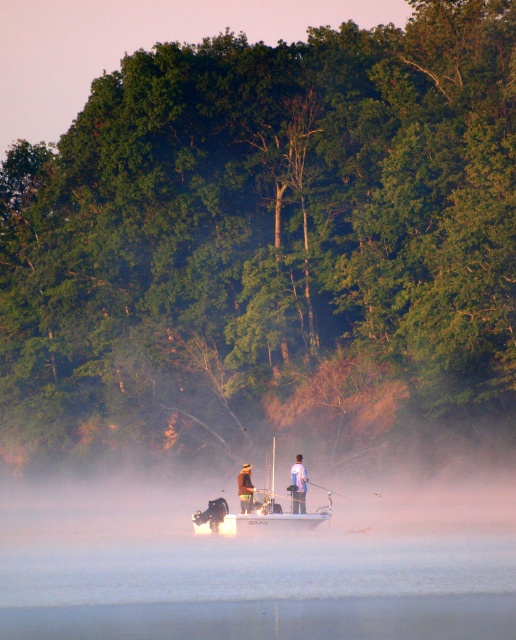
The width and height of the screenshot is (516, 640). Describe the element at coordinates (262, 506) in the screenshot. I see `white plastic boat at center` at that location.

Image resolution: width=516 pixels, height=640 pixels. In order to click on white plastic boat at center in this screenshot , I will do `click(262, 506)`.

From the picture: Who is lower down, white plastic boat at center or blue fabric shirt at center?

blue fabric shirt at center is lower down.

Is point (223, 513) positioned before point (303, 497)?

Yes, point (223, 513) is in front of point (303, 497).

Image resolution: width=516 pixels, height=640 pixels. What are the coordinates of `white plastic boat at center` in the screenshot? It's located at (262, 506).

Is blue fabric shirt at center below brown leather jacket at center?

Yes.

Who is more forward, (294, 512) or (249, 465)?

Point (294, 512) is in front.

Based on the photo, who is more forward, (296, 492) or (249, 490)?

Point (296, 492)

At what (x,y) coordinates should I click in order to perform the action: click on blue fabric shirt at center. Please return your answer as a coordinate pair (x, y). The height and width of the screenshot is (640, 516). Looking at the image, I should click on (298, 484).